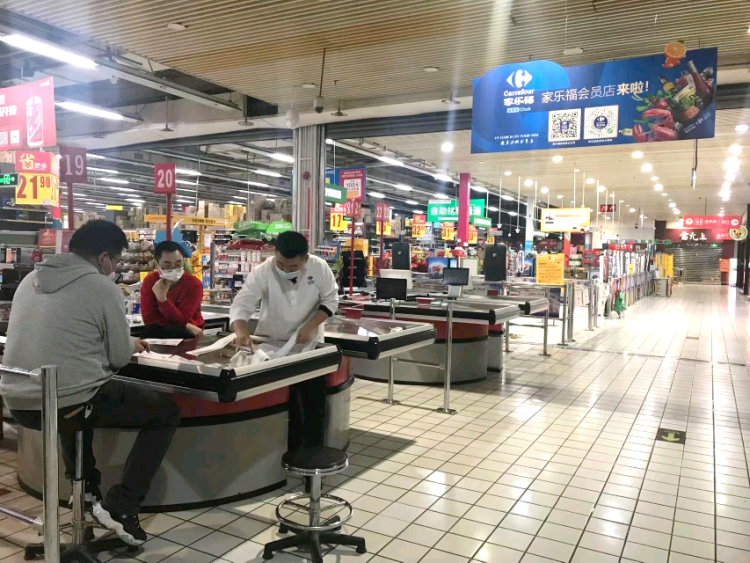
Locate an element on the screen. This screenshot has height=563, width=750. tile floor is located at coordinates tap(520, 486).